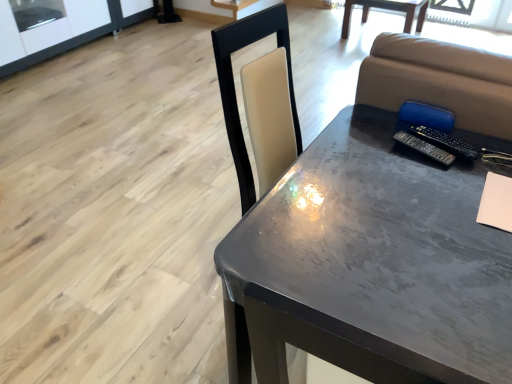
Question: Is black plastic remote at right, the 2th remote viewed from the right, wider than beige matte notebook at lower right?

Choices:
 (A) yes
 (B) no

Answer: (B)

Question: From the image's perspective, is black plastic remote at right, the 2th remote viewed from the right, above beige matte notebook at lower right?

Choices:
 (A) no
 (B) yes

Answer: (B)

Question: From the image's perspective, would you say black plastic remote at right, which appears as the first remote when viewed from the left, is shown under beige matte notebook at lower right?

Choices:
 (A) yes
 (B) no

Answer: (B)

Question: Is black plastic remote at right, the 2th remote viewed from the right, shorter than beige matte notebook at lower right?

Choices:
 (A) yes
 (B) no

Answer: (B)

Question: Can you confirm if black plastic remote at right, the 2th remote viewed from the right, is smaller than beige matte notebook at lower right?

Choices:
 (A) no
 (B) yes

Answer: (B)

Question: In the image, is black plastic remote at right, which appears as the first remote when viewed from the left, on the left side or the right side of beige matte notebook at lower right?

Choices:
 (A) left
 (B) right

Answer: (A)

Question: From a real-world perspective, relative to beige matte notebook at lower right, is black plastic remote at right, which appears as the first remote when viewed from the left, vertically above or below?

Choices:
 (A) below
 (B) above

Answer: (B)

Question: Relative to beige matte notebook at lower right, is black plastic remote at right, which appears as the first remote when viewed from the left, in front or behind?

Choices:
 (A) behind
 (B) front

Answer: (A)

Question: Is point (442, 150) positioned closer to the camera than point (501, 185)?

Choices:
 (A) closer
 (B) farther

Answer: (B)

Question: From the image's perspective, relative to beige matte notebook at lower right, is metallic gray table at center, the 2th table positioned from the back, above or below?

Choices:
 (A) above
 (B) below

Answer: (B)

Question: Visually, is metallic gray table at center, which ranks as the 2th table in right-to-left order, positioned to the left or to the right of beige matte notebook at lower right?

Choices:
 (A) right
 (B) left

Answer: (B)

Question: Is metallic gray table at center, which ranks as the 2th table in right-to-left order, wider or thinner than beige matte notebook at lower right?

Choices:
 (A) thin
 (B) wide

Answer: (B)

Question: Is point (439, 279) positioned closer to the camera than point (506, 185)?

Choices:
 (A) closer
 (B) farther

Answer: (A)

Question: Would you say black plastic remote at right, which appears as the first remote when viewed from the left, is to the left or to the right of metallic gray table at center, the 2th table ordered from the bottom, in the picture?

Choices:
 (A) left
 (B) right

Answer: (A)

Question: Which is correct: black plastic remote at right, the 2th remote viewed from the right, is inside metallic gray table at center, positioned as the 2th table in front-to-back order, or outside of it?

Choices:
 (A) outside
 (B) inside

Answer: (A)